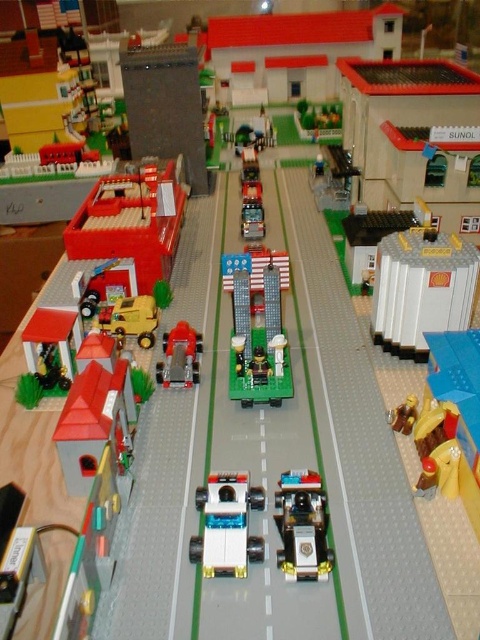
Which is in front, point (252, 548) or point (180, 356)?

Point (252, 548) is in front.

Is point (191, 556) farther from camera compared to point (186, 358)?

No, it is in front of (186, 358).

Who is more forward, (197, 500) or (166, 381)?

Point (197, 500) is in front.

The height and width of the screenshot is (640, 480). Identify the location of translucent white plastic car at center. (227, 525).

Is translucent white plastic car at center thinner than shiny black police car at center?

No, translucent white plastic car at center is not thinner than shiny black police car at center.

Can you confirm if translucent white plastic car at center is smaller than shiny black police car at center?

No, translucent white plastic car at center is not smaller than shiny black police car at center.

Which is in front, point (228, 548) or point (316, 508)?

Point (228, 548) is more forward.

Locate an element on the screen. Image resolution: width=480 pixels, height=640 pixels. translucent white plastic car at center is located at coordinates (227, 525).

Does shiny black police car at center have a greater height compared to metallic silver fire truck at center?

No.

Can you confirm if shiny black police car at center is smaller than metallic silver fire truck at center?

Yes.

Who is more forward, (296, 554) or (195, 365)?

Point (296, 554) is in front.

Where is `shiny black police car at center`? This screenshot has width=480, height=640. shiny black police car at center is located at coordinates (302, 525).